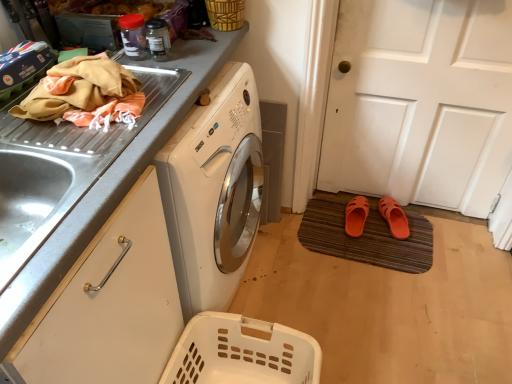
Question: Is white matte door at lower right thinner than metallic gray countertop at upper left?

Choices:
 (A) yes
 (B) no

Answer: (A)

Question: Would you say white matte door at lower right contains metallic gray countertop at upper left?

Choices:
 (A) no
 (B) yes

Answer: (A)

Question: Could you tell me if white matte door at lower right is facing metallic gray countertop at upper left?

Choices:
 (A) yes
 (B) no

Answer: (B)

Question: From a real-world perspective, is white matte door at lower right over metallic gray countertop at upper left?

Choices:
 (A) yes
 (B) no

Answer: (A)

Question: From the image's perspective, is white matte door at lower right under metallic gray countertop at upper left?

Choices:
 (A) yes
 (B) no

Answer: (B)

Question: Can you confirm if white matte door at lower right is shorter than metallic gray countertop at upper left?

Choices:
 (A) no
 (B) yes

Answer: (A)

Question: Does orange fabric at upper left have a larger size compared to orange rubber sandals at lower right, which appears as the 2th footwear when viewed from the left?

Choices:
 (A) yes
 (B) no

Answer: (A)

Question: From the image's perspective, is orange fabric at upper left above orange rubber sandals at lower right, positioned as the 1th footwear in right-to-left order?

Choices:
 (A) no
 (B) yes

Answer: (B)

Question: Does orange fabric at upper left have a lesser height compared to orange rubber sandals at lower right, which appears as the 2th footwear when viewed from the left?

Choices:
 (A) yes
 (B) no

Answer: (B)

Question: From the image's perspective, does orange fabric at upper left appear lower than orange rubber sandals at lower right, which appears as the 2th footwear when viewed from the left?

Choices:
 (A) yes
 (B) no

Answer: (B)

Question: Considering the relative positions of orange fabric at upper left and orange rubber sandals at lower right, positioned as the 1th footwear in right-to-left order, in the image provided, is orange fabric at upper left to the right of orange rubber sandals at lower right, positioned as the 1th footwear in right-to-left order, from the viewer's perspective?

Choices:
 (A) no
 (B) yes

Answer: (A)

Question: From a real-world perspective, is orange fabric at upper left under orange rubber sandals at lower right, positioned as the 1th footwear in right-to-left order?

Choices:
 (A) no
 (B) yes

Answer: (A)

Question: Does woven bamboo basket at upper center, which ranks as the second basket in bottom-to-top order, contain brown textured doormat at lower right?

Choices:
 (A) no
 (B) yes

Answer: (A)